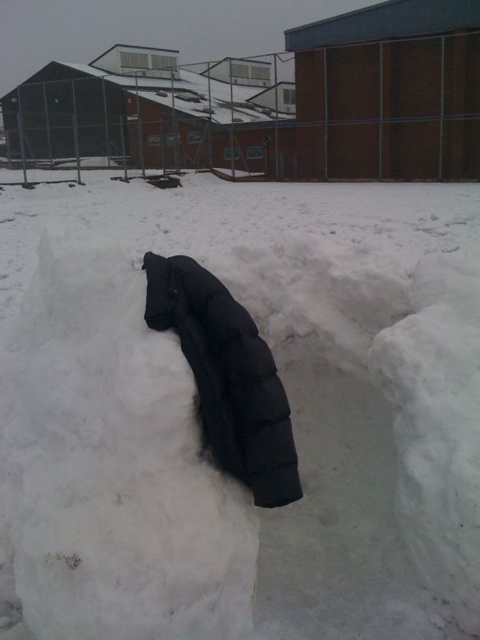
You are an explorer in a snowy area and need to decide where to place your equipment. You have a black down jacket at center and white fluffy snow at center. Which object is located to the left of the other?

The white fluffy snow at center is to the left of the black down jacket at center.

You are planning to build a snowman using the white fluffy snow at center and need to place the black down jacket at center nearby. What is the minimum distance you need to keep between the snowman and the jacket to ensure they don not touch each other?

The white fluffy snow at center and black down jacket at center are 34.84 inches apart from each other. To ensure they do not touch, the minimum distance should be at least 34.84 inches.

Based on the photo, you are planning to build a snowman using the white fluffy snow at center and the black down jacket at center. Which object can you use to form the base of the snowman?

The white fluffy snow at center has a larger size compared to the black down jacket at center, so it can be used to form the base of the snowman.